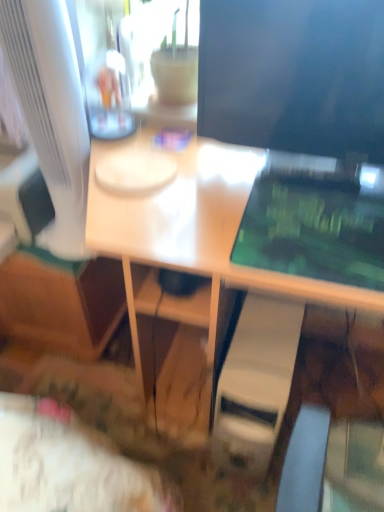
Question: Are white glossy desk at center and white glossy computer monitor at left, the second computer monitor from the right, far apart?

Choices:
 (A) no
 (B) yes

Answer: (A)

Question: Can you confirm if white glossy desk at center is positioned to the left of white glossy computer monitor at left, positioned as the 1th computer monitor in left-to-right order?

Choices:
 (A) yes
 (B) no

Answer: (B)

Question: Is white glossy desk at center taller than white glossy computer monitor at left, positioned as the 1th computer monitor in left-to-right order?

Choices:
 (A) no
 (B) yes

Answer: (B)

Question: Is white glossy desk at center wider than white glossy computer monitor at left, the second computer monitor from the right?

Choices:
 (A) no
 (B) yes

Answer: (B)

Question: From the image's perspective, would you say white glossy desk at center is positioned over white glossy computer monitor at left, positioned as the 1th computer monitor in left-to-right order?

Choices:
 (A) yes
 (B) no

Answer: (B)

Question: Considering the positions of white plastic computer tower at lower center and matte black monitor at upper right, which appears as the first computer monitor when viewed from the right, in the image, is white plastic computer tower at lower center wider or thinner than matte black monitor at upper right, which appears as the first computer monitor when viewed from the right,?

Choices:
 (A) wide
 (B) thin

Answer: (A)

Question: Is point (233, 348) closer or farther from the camera than point (360, 147)?

Choices:
 (A) farther
 (B) closer

Answer: (A)

Question: Is white plastic computer tower at lower center bigger or smaller than matte black monitor at upper right, which appears as the first computer monitor when viewed from the right?

Choices:
 (A) small
 (B) big

Answer: (B)

Question: Considering their positions, is white plastic computer tower at lower center located in front of or behind matte black monitor at upper right, the second computer monitor when ordered from left to right?

Choices:
 (A) behind
 (B) front

Answer: (A)

Question: Is point (112, 250) closer or farther from the camera than point (253, 431)?

Choices:
 (A) closer
 (B) farther

Answer: (A)

Question: Considering their positions, is white glossy desk at center located in front of or behind white plastic computer tower at lower center?

Choices:
 (A) front
 (B) behind

Answer: (A)

Question: From the image's perspective, relative to white plastic computer tower at lower center, is white glossy desk at center above or below?

Choices:
 (A) below
 (B) above

Answer: (B)

Question: Would you say white glossy desk at center is to the left or to the right of white plastic computer tower at lower center in the picture?

Choices:
 (A) right
 (B) left

Answer: (B)

Question: Is white glossy desk at center inside or outside of white glossy computer monitor at left, the second computer monitor from the right?

Choices:
 (A) outside
 (B) inside

Answer: (A)

Question: In the image, is white glossy desk at center on the left side or the right side of white glossy computer monitor at left, positioned as the 1th computer monitor in left-to-right order?

Choices:
 (A) right
 (B) left

Answer: (A)